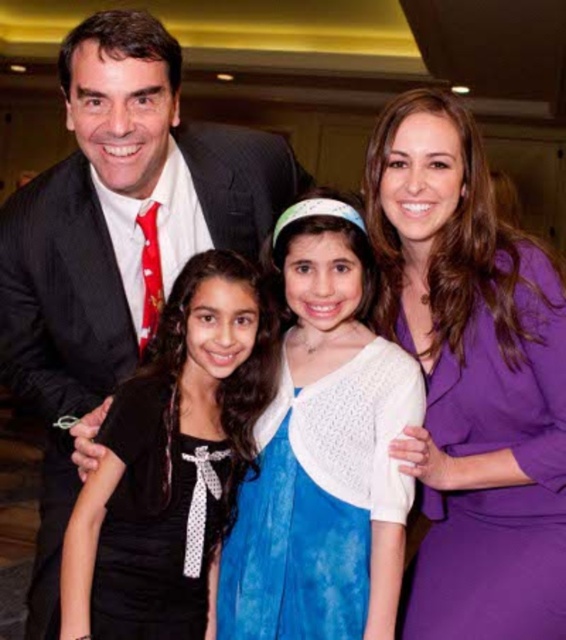
Who is more distant from viewer, (76, 81) or (345, 540)?

Point (345, 540)

Who is positioned more to the right, matte black suit at left or blue tie-dye dress at center?

From the viewer's perspective, blue tie-dye dress at center appears more on the right side.

Image resolution: width=566 pixels, height=640 pixels. What are the coordinates of `matte black suit at left` in the screenshot? It's located at (117, 241).

Is matte black suit at left smaller than black satin dress at center?

Actually, matte black suit at left might be larger than black satin dress at center.

Can you confirm if matte black suit at left is positioned to the left of black satin dress at center?

Correct, you'll find matte black suit at left to the left of black satin dress at center.

Where is `matte black suit at left`? This screenshot has height=640, width=566. matte black suit at left is located at coordinates (117, 241).

Is purple satin dress at right bigger than black satin dress at center?

Yes, purple satin dress at right is bigger than black satin dress at center.

Who is shorter, purple satin dress at right or black satin dress at center?

With less height is black satin dress at center.

Who is more forward, [457,580] or [149,624]?

Positioned in front is point [149,624].

Image resolution: width=566 pixels, height=640 pixels. Find the location of `purple satin dress at right`. purple satin dress at right is located at coordinates (473, 380).